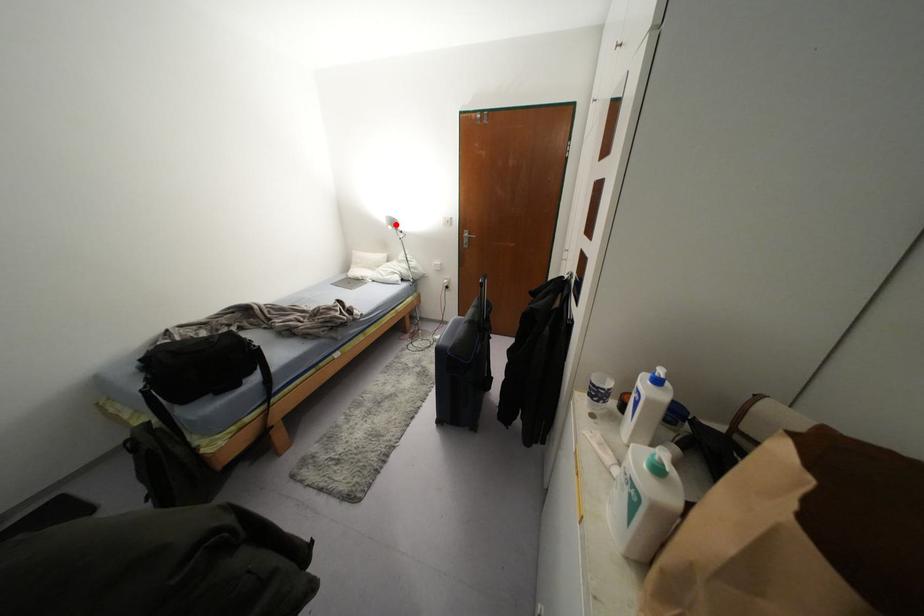
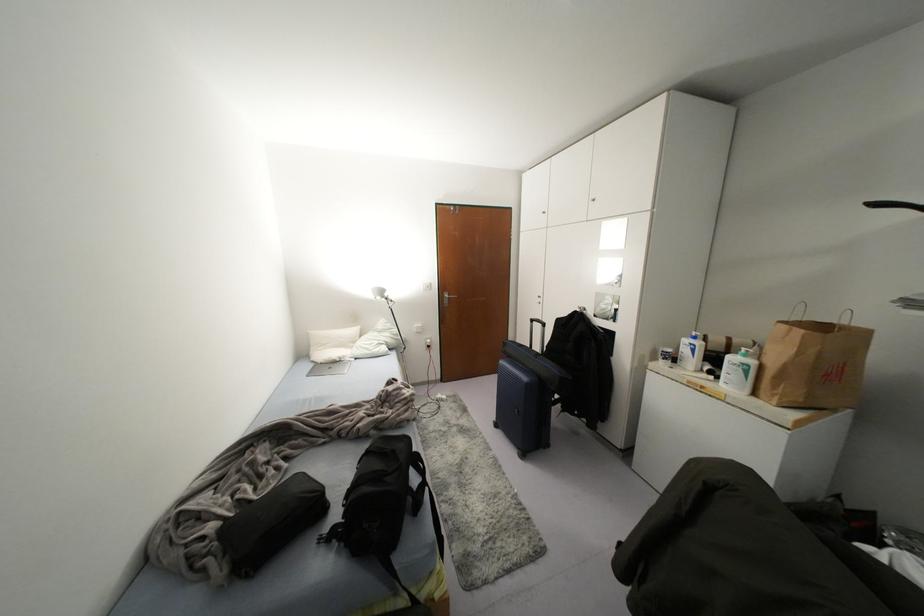
Where in the second image is the point corresponding to the highlighted location from the first image?

(385, 294)